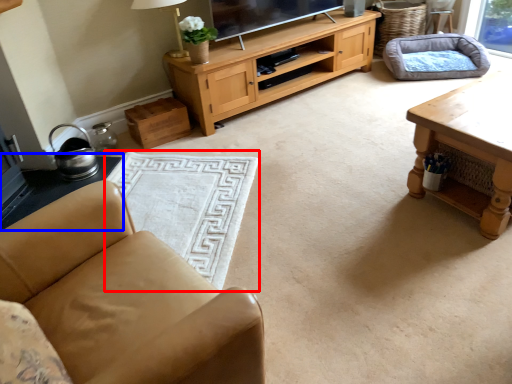
Question: Which object is closer to the camera taking this photo, flat (highlighted by a red box) or side table (highlighted by a blue box)?

Choices:
 (A) flat
 (B) side table

Answer: (A)